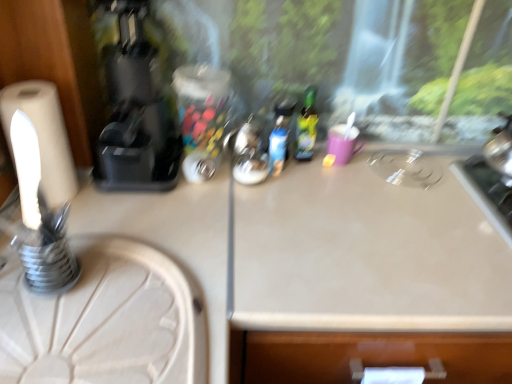
Locate an element on the screen. The height and width of the screenshot is (384, 512). spots to the right of green glass bottle at center, the second bottle positioned from the left is located at coordinates (367, 172).